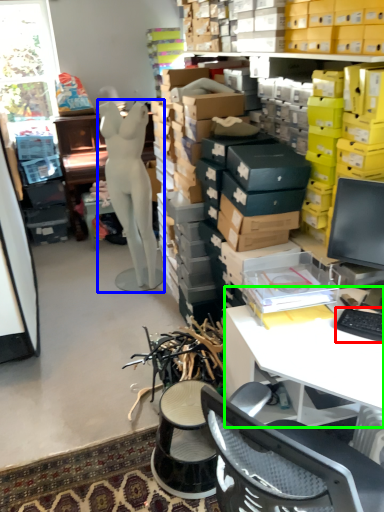
Question: Which object is positioned closest to computer keyboard (highlighted by a red box)? Select from person (highlighted by a blue box) and desk (highlighted by a green box).

Choices:
 (A) person
 (B) desk

Answer: (B)